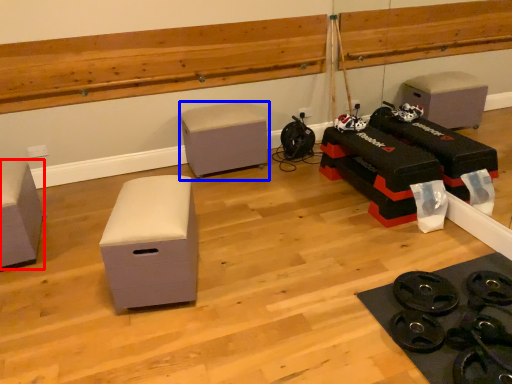
Question: Which of the following is the closest to the observer, furniture (highlighted by a red box) or furniture (highlighted by a blue box)?

Choices:
 (A) furniture
 (B) furniture

Answer: (A)